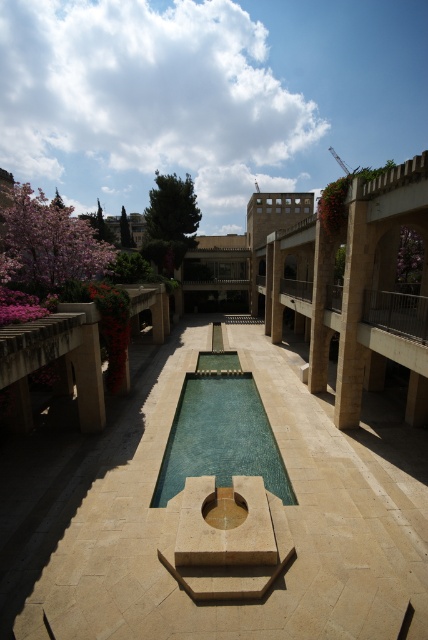
Is smooth stone fountain at center to the right of brown stone pillar at center from the viewer's perspective?

In fact, smooth stone fountain at center is to the left of brown stone pillar at center.

Between point (148, 408) and point (321, 355), which one is positioned behind?

The point (321, 355) is behind.

The height and width of the screenshot is (640, 428). In order to click on smooth stone fountain at center in this screenshot , I will do `click(219, 484)`.

Does green glass swimming pool at center have a greater height compared to brown stone pillar at center?

No.

Can you confirm if green glass swimming pool at center is bigger than brown stone pillar at center?

Correct, green glass swimming pool at center is larger in size than brown stone pillar at center.

You are a GUI agent. You are given a task and a screenshot of the screen. Output one action in this format:
    pyautogui.click(x=<x>, y=<y>)
    Task: Click on the green glass swimming pool at center
    Image resolution: width=428 pixels, height=640 pixels.
    Given the screenshot: What is the action you would take?
    pyautogui.click(x=220, y=433)

You are a GUI agent. You are given a task and a screenshot of the screen. Output one action in this format:
    pyautogui.click(x=<x>, y=<y>)
    Task: Click on the green glass swimming pool at center
    The width and height of the screenshot is (428, 640).
    Given the screenshot: What is the action you would take?
    (220, 433)

Does beige stone pillar at right appear over brown stone pillar at center?

No, beige stone pillar at right is not above brown stone pillar at center.

What do you see at coordinates (353, 310) in the screenshot?
I see `beige stone pillar at right` at bounding box center [353, 310].

Locate an element on the screen. beige stone pillar at right is located at coordinates (353, 310).